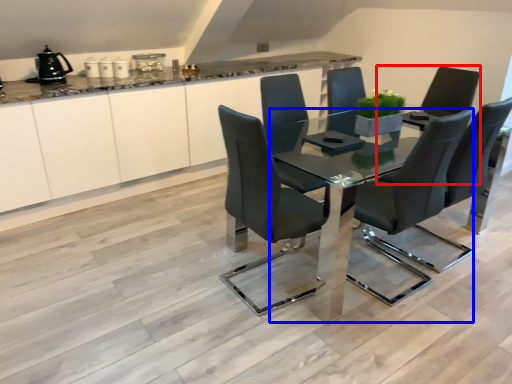
Question: Which object appears farthest to the camera in this image, armchair (highlighted by a red box) or table (highlighted by a blue box)?

Choices:
 (A) armchair
 (B) table

Answer: (A)